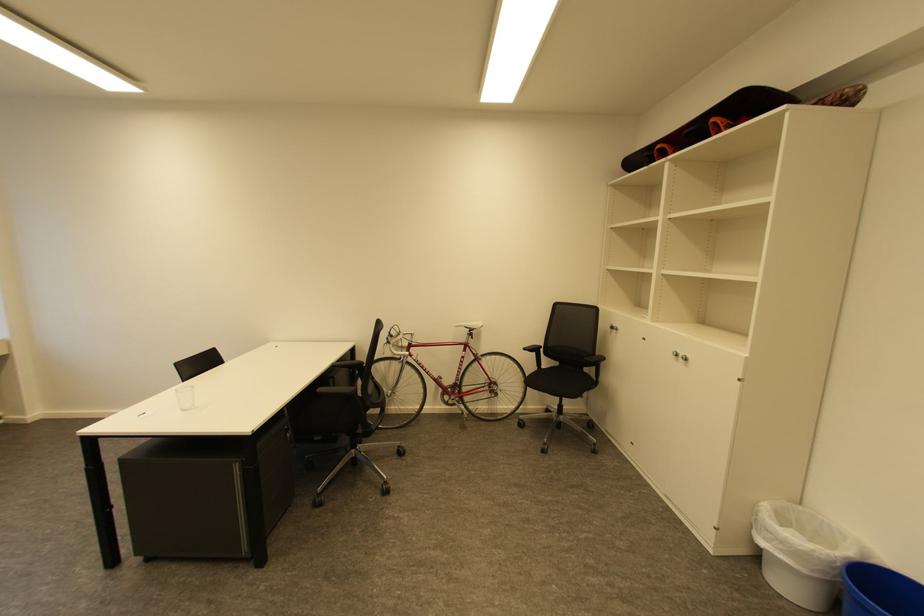
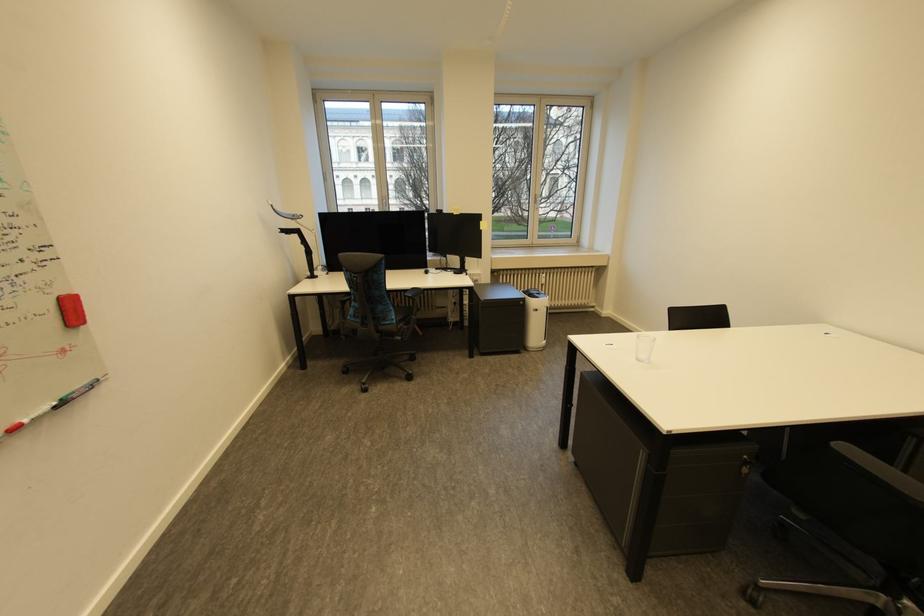
Where in the second image is the point corresponding to [324,511] from the first image?

(750, 604)